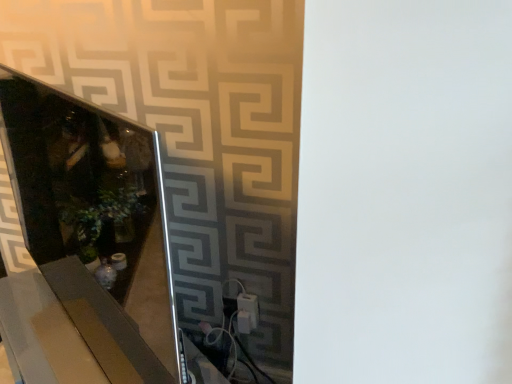
You are a GUI agent. You are given a task and a screenshot of the screen. Output one action in this format:
    pyautogui.click(x=<x>, y=<y>)
    Task: Click on the polished glass mirror at left
    The width and height of the screenshot is (512, 384).
    Given the screenshot: What is the action you would take?
    pyautogui.click(x=82, y=234)

Image resolution: width=512 pixels, height=384 pixels. What do you see at coordinates (82, 234) in the screenshot?
I see `polished glass mirror at left` at bounding box center [82, 234].

The height and width of the screenshot is (384, 512). Identify the location of polished glass mirror at left. (82, 234).